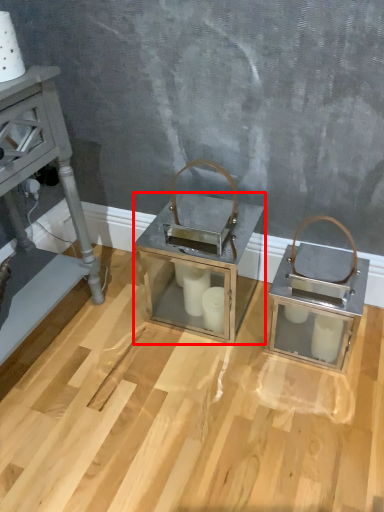
Question: Considering the relative positions of table (annotated by the red box) and furniture in the image provided, where is table (annotated by the red box) located with respect to the staircase?

Choices:
 (A) left
 (B) right

Answer: (B)